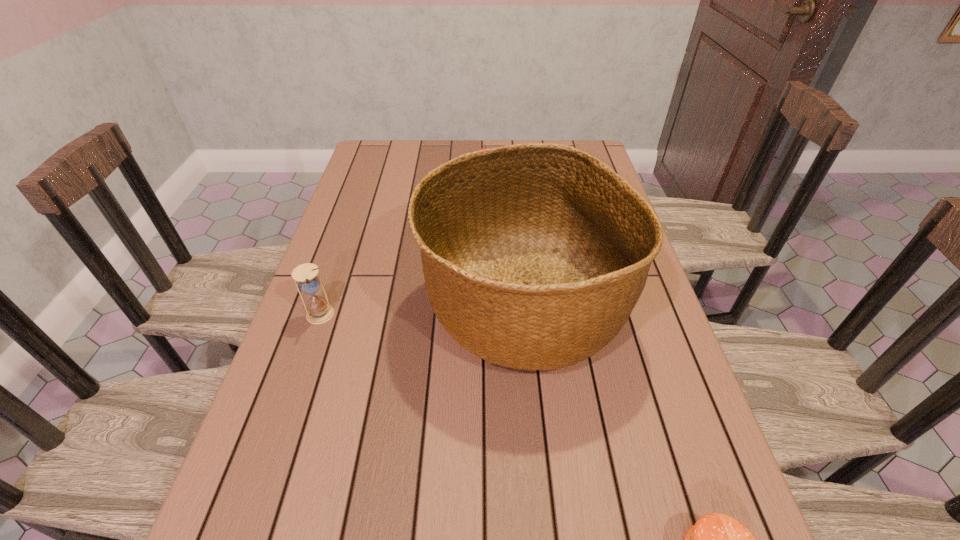
Locate an element on the screen. object that is at the right edge is located at coordinates (534, 255).

In order to click on vacant space at the far edge of the desktop in this screenshot , I will do `click(434, 141)`.

This screenshot has width=960, height=540. I want to click on vacant region at the left edge, so click(x=264, y=417).

This screenshot has height=540, width=960. Find the location of `free spot at the right edge of the desktop`. free spot at the right edge of the desktop is located at coordinates (648, 373).

You are a GUI agent. You are given a task and a screenshot of the screen. Output one action in this format:
    pyautogui.click(x=<x>, y=<y>)
    Task: Click on the free space between the third shortest object and the basket
    The height and width of the screenshot is (540, 960).
    Given the screenshot: What is the action you would take?
    pyautogui.click(x=421, y=310)

Image resolution: width=960 pixels, height=540 pixels. In order to click on vacant point located between the apple and the second tallest object in this screenshot , I will do `click(402, 247)`.

I want to click on object that is the second closest to the shortest object, so click(x=318, y=312).

You are a GUI agent. You are given a task and a screenshot of the screen. Output one action in this format:
    pyautogui.click(x=<x>, y=<y>)
    Task: Click on the object that stands as the second closest to the shortest object
    The width and height of the screenshot is (960, 540).
    Given the screenshot: What is the action you would take?
    pyautogui.click(x=318, y=312)

Identify the location of free space that satisfies the following two spatial constraints: 1. on the front side of the tallest object; 2. on the right side of the farthest object. (487, 305).